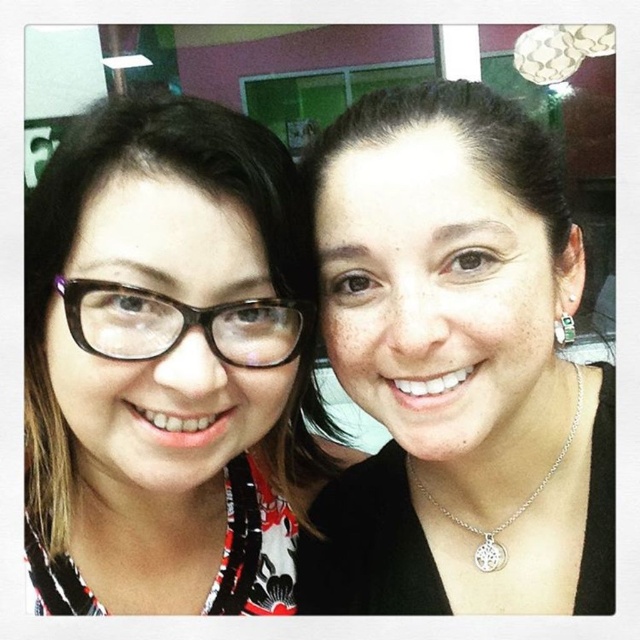
You are a photographer adjusting the lighting for a portrait. You notice the matte black glasses at left and the silver metallic necklace at center. Which object is covering the other in the image?

The matte black glasses at left is positioned over the silver metallic necklace at center, so it is covering the necklace.

You are a photographer trying to capture a closeup shot of both the matte black glasses at left and the silver metallic necklace at center in the same frame. Given that your camera has a minimum focus distance of 10 inches, will you be able to focus on both objects simultaneously?

The matte black glasses at left and silver metallic necklace at center are 10.47 inches apart, which exceeds the camera minimum focus distance of 10 inches. Therefore, the camera can focus on both objects simultaneously.

You are trying to locate the matte black glasses at left in the image. Based on the coordinates provided, which direction should you look relative to the center of the image?

The matte black glasses at left are located at coordinates point [168,365]. Since the x coordinate is 0.572 which is less than 0.6, you should look to the left of the center of the image.